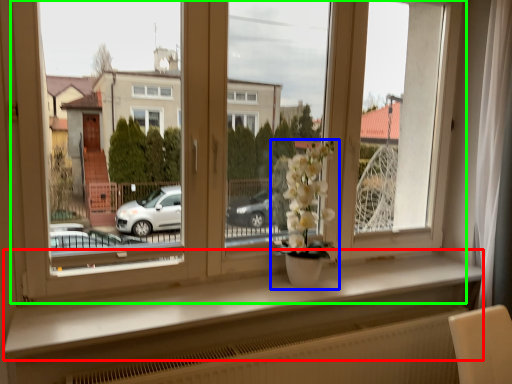
Question: Which is farther away from window sill (highlighted by a red box)? houseplant (highlighted by a blue box) or window (highlighted by a green box)?

Choices:
 (A) houseplant
 (B) window

Answer: (B)